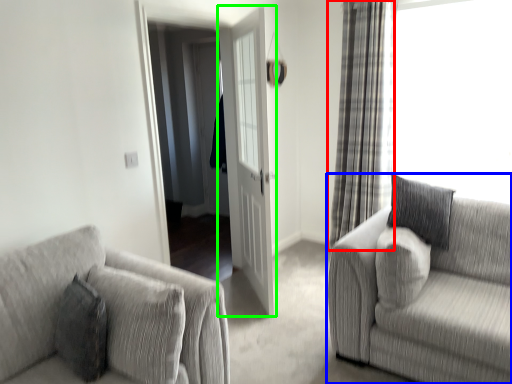
Question: Considering the real-world distances, which object is farthest from curtain (highlighted by a red box)? studio couch (highlighted by a blue box) or door (highlighted by a green box)?

Choices:
 (A) studio couch
 (B) door

Answer: (A)